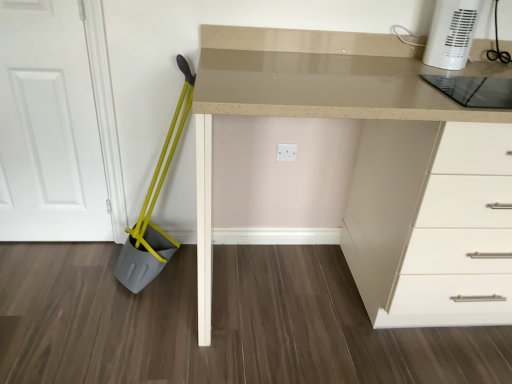
Question: Can you confirm if transparent glass cutting board at upper right is thinner than yellow plastic shovel at left?

Choices:
 (A) no
 (B) yes

Answer: (A)

Question: Is there a large distance between transparent glass cutting board at upper right and yellow plastic shovel at left?

Choices:
 (A) no
 (B) yes

Answer: (B)

Question: From the image's perspective, would you say transparent glass cutting board at upper right is shown under yellow plastic shovel at left?

Choices:
 (A) no
 (B) yes

Answer: (A)

Question: Is transparent glass cutting board at upper right aimed at yellow plastic shovel at left?

Choices:
 (A) yes
 (B) no

Answer: (B)

Question: Is transparent glass cutting board at upper right oriented away from yellow plastic shovel at left?

Choices:
 (A) no
 (B) yes

Answer: (A)

Question: Looking at their shapes, would you say matte beige desk at center is wider or thinner than yellow plastic shovel at left?

Choices:
 (A) wide
 (B) thin

Answer: (A)

Question: From their relative heights in the image, would you say matte beige desk at center is taller or shorter than yellow plastic shovel at left?

Choices:
 (A) tall
 (B) short

Answer: (A)

Question: Looking at the image, does matte beige desk at center seem bigger or smaller compared to yellow plastic shovel at left?

Choices:
 (A) small
 (B) big

Answer: (B)

Question: Choose the correct answer: Is matte beige desk at center inside yellow plastic shovel at left or outside it?

Choices:
 (A) inside
 (B) outside

Answer: (B)

Question: From a real-world perspective, is white matte door at left above or below white plastic heater at upper right?

Choices:
 (A) below
 (B) above

Answer: (A)

Question: Is point (49, 29) positioned closer to the camera than point (445, 41)?

Choices:
 (A) farther
 (B) closer

Answer: (A)

Question: In terms of size, does white matte door at left appear bigger or smaller than white plastic heater at upper right?

Choices:
 (A) big
 (B) small

Answer: (A)

Question: From their relative heights in the image, would you say white matte door at left is taller or shorter than white plastic heater at upper right?

Choices:
 (A) short
 (B) tall

Answer: (B)

Question: In terms of size, does transparent glass cutting board at upper right appear bigger or smaller than white plastic heater at upper right?

Choices:
 (A) big
 (B) small

Answer: (B)

Question: In terms of width, does transparent glass cutting board at upper right look wider or thinner when compared to white plastic heater at upper right?

Choices:
 (A) thin
 (B) wide

Answer: (B)